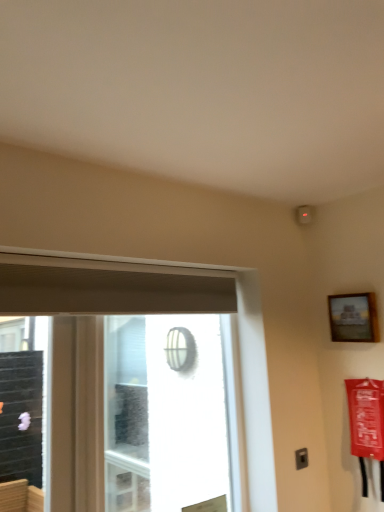
Question: Does white mesh screen at center lie behind transparent glass window at center?

Choices:
 (A) no
 (B) yes

Answer: (B)

Question: Does white mesh screen at center have a smaller size compared to transparent glass window at center?

Choices:
 (A) yes
 (B) no

Answer: (A)

Question: From the image's perspective, is white mesh screen at center located above transparent glass window at center?

Choices:
 (A) no
 (B) yes

Answer: (B)

Question: From a real-world perspective, is white mesh screen at center below transparent glass window at center?

Choices:
 (A) yes
 (B) no

Answer: (B)

Question: Does white mesh screen at center contain transparent glass window at center?

Choices:
 (A) yes
 (B) no

Answer: (A)

Question: From a real-world perspective, relative to transparent glass window at center, is white mesh screen at center vertically above or below?

Choices:
 (A) below
 (B) above

Answer: (B)

Question: In the image, is white mesh screen at center on the left side or the right side of transparent glass window at center?

Choices:
 (A) right
 (B) left

Answer: (A)

Question: From the image's perspective, relative to transparent glass window at center, is white mesh screen at center above or below?

Choices:
 (A) above
 (B) below

Answer: (A)

Question: Does point (107, 362) appear closer or farther from the camera than point (8, 285)?

Choices:
 (A) closer
 (B) farther

Answer: (B)

Question: Relative to white mesh screen at center, is wooden frame at upper right in front or behind?

Choices:
 (A) behind
 (B) front

Answer: (A)

Question: Is wooden frame at upper right inside or outside of white mesh screen at center?

Choices:
 (A) inside
 (B) outside

Answer: (B)

Question: From a real-world perspective, is wooden frame at upper right physically located above or below white mesh screen at center?

Choices:
 (A) above
 (B) below

Answer: (A)

Question: From the image's perspective, is wooden frame at upper right located above or below white mesh screen at center?

Choices:
 (A) above
 (B) below

Answer: (A)

Question: Considering the positions of transparent glass window at center and wooden frame at upper right in the image, is transparent glass window at center taller or shorter than wooden frame at upper right?

Choices:
 (A) short
 (B) tall

Answer: (B)

Question: Is transparent glass window at center inside or outside of wooden frame at upper right?

Choices:
 (A) outside
 (B) inside

Answer: (A)